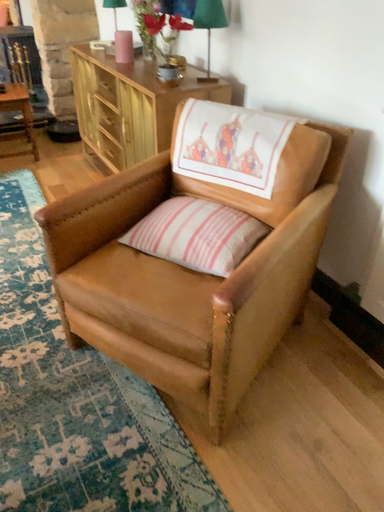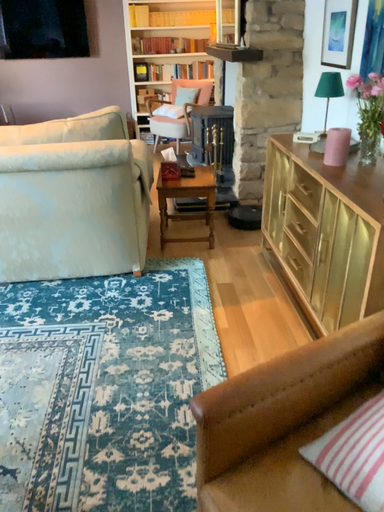
Question: Which way did the camera rotate in the video?

Choices:
 (A) rotated left
 (B) rotated right

Answer: (A)